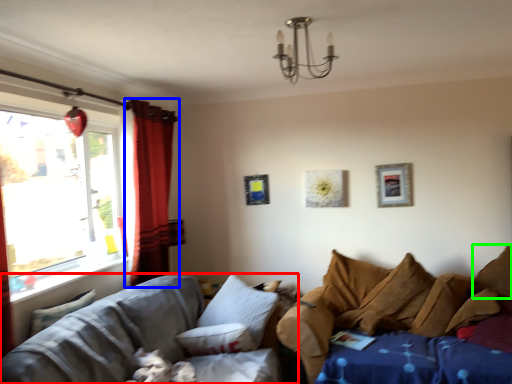
Question: Which is nearer to the studio couch (highlighted by a red box)? curtain (highlighted by a blue box) or pillow (highlighted by a green box).

Choices:
 (A) curtain
 (B) pillow

Answer: (A)